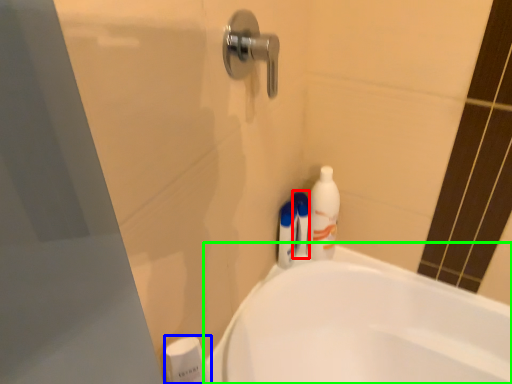
Question: Which object is the farthest from shaving cream (highlighted by a red box)? Choose among these: toiletry (highlighted by a blue box) or bathtub (highlighted by a green box).

Choices:
 (A) toiletry
 (B) bathtub

Answer: (A)